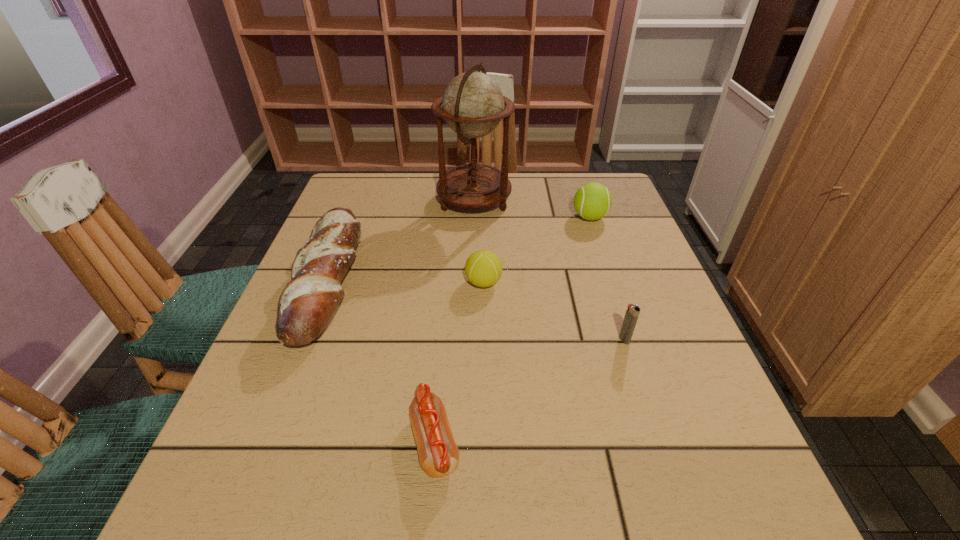
At what (x,y) coordinates should I click in order to perform the action: click on vacant space located 0.330m on the left of the taller tennis ball. Please return your answer as a coordinate pair (x, y). This screenshot has height=540, width=960. Looking at the image, I should click on (446, 217).

Locate an element on the screen. The width and height of the screenshot is (960, 540). vacant space situated 0.210m on the right of the baguet is located at coordinates [450, 281].

Locate an element on the screen. free point located on the back of the igniter is located at coordinates (592, 240).

Where is `vacant space located 0.080m on the front of the left tennis ball`? Image resolution: width=960 pixels, height=540 pixels. vacant space located 0.080m on the front of the left tennis ball is located at coordinates (484, 323).

Locate an element on the screen. The width and height of the screenshot is (960, 540). vacant space located 0.100m on the left of the sausage is located at coordinates (344, 442).

The height and width of the screenshot is (540, 960). Identify the location of globe that is at the far edge. (472, 104).

You are a GUI agent. You are given a task and a screenshot of the screen. Output one action in this format:
    pyautogui.click(x=<x>, y=<y>)
    Task: Click on the tennis ball that is at the far edge
    This screenshot has width=960, height=540.
    Given the screenshot: What is the action you would take?
    pyautogui.click(x=592, y=201)

The image size is (960, 540). Identify the location of object situated at the near edge. (438, 453).

At what (x,y) coordinates should I click in order to perform the action: click on object at the left edge. Please return your answer as a coordinate pair (x, y). Image resolution: width=960 pixels, height=540 pixels. Looking at the image, I should click on (307, 303).

The image size is (960, 540). I want to click on tennis ball present at the right edge, so click(x=592, y=201).